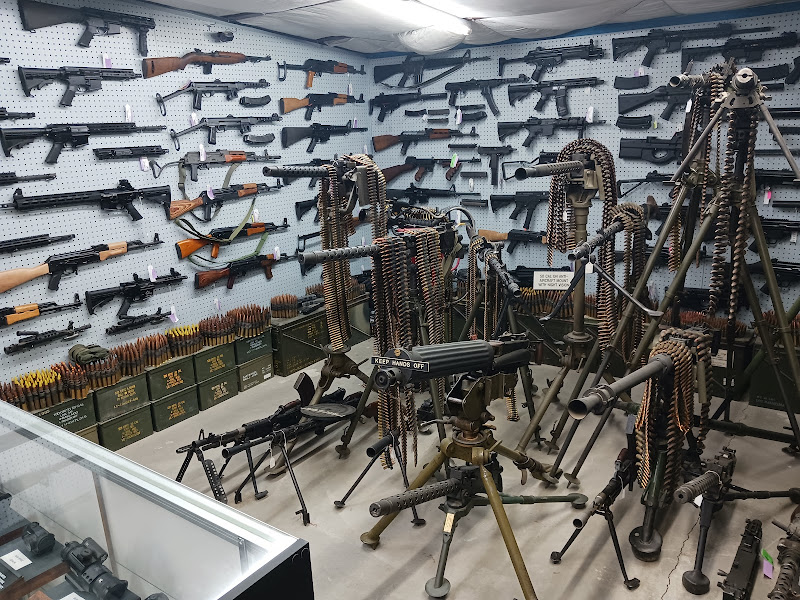
Locate an element on the screen. This screenshot has height=600, width=800. hook is located at coordinates (500, 183).